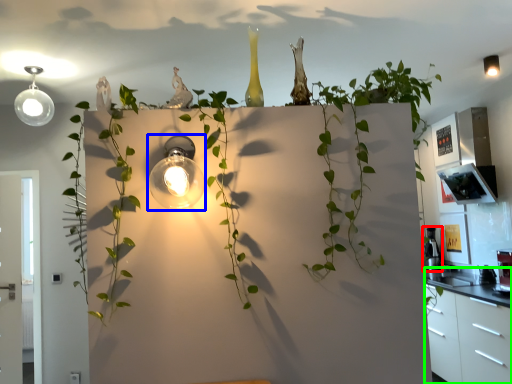
Question: Considering the real-world distances, which object is farthest from appliance (highlighted by a red box)? light fixture (highlighted by a blue box) or dresser (highlighted by a green box)?

Choices:
 (A) light fixture
 (B) dresser

Answer: (A)